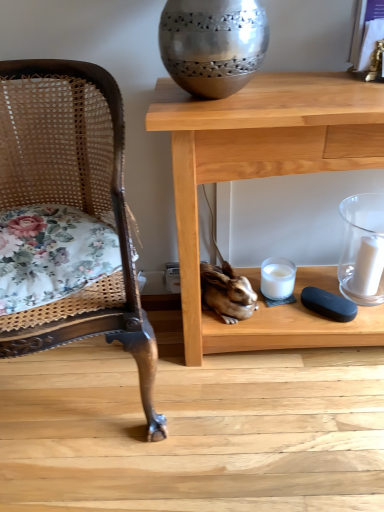
Question: From a real-world perspective, is white matte candle at right physically below woven cane chair at left?

Choices:
 (A) no
 (B) yes

Answer: (B)

Question: Is white matte candle at right thinner than woven cane chair at left?

Choices:
 (A) yes
 (B) no

Answer: (A)

Question: Does white matte candle at right have a greater height compared to woven cane chair at left?

Choices:
 (A) yes
 (B) no

Answer: (B)

Question: Is white matte candle at right smaller than woven cane chair at left?

Choices:
 (A) yes
 (B) no

Answer: (A)

Question: From a real-world perspective, is white matte candle at right located higher than woven cane chair at left?

Choices:
 (A) no
 (B) yes

Answer: (A)

Question: Considering the positions of woven cane chair at left and clear glass candle at right, marked as the 2th candle holder in a left-to-right arrangement, in the image, is woven cane chair at left taller or shorter than clear glass candle at right, marked as the 2th candle holder in a left-to-right arrangement,?

Choices:
 (A) short
 (B) tall

Answer: (B)

Question: Considering the positions of point (120, 141) and point (354, 252), is point (120, 141) closer or farther from the camera than point (354, 252)?

Choices:
 (A) farther
 (B) closer

Answer: (B)

Question: In terms of size, does woven cane chair at left appear bigger or smaller than clear glass candle at right, acting as the 1th candle holder starting from the right?

Choices:
 (A) small
 (B) big

Answer: (B)

Question: In terms of width, does woven cane chair at left look wider or thinner when compared to clear glass candle at right, acting as the 1th candle holder starting from the right?

Choices:
 (A) wide
 (B) thin

Answer: (A)

Question: From a real-world perspective, is white matte candle at right above or below wooden table at center?

Choices:
 (A) above
 (B) below

Answer: (B)

Question: Is white matte candle at right inside the boundaries of wooden table at center, or outside?

Choices:
 (A) outside
 (B) inside

Answer: (B)

Question: From the image's perspective, is white matte candle at right above or below wooden table at center?

Choices:
 (A) below
 (B) above

Answer: (A)

Question: Is white matte candle at right wider or thinner than wooden table at center?

Choices:
 (A) thin
 (B) wide

Answer: (A)

Question: Looking at the image, does white glass candle at lower center, marked as the first candle holder in a left-to-right arrangement, seem bigger or smaller compared to wooden table at center?

Choices:
 (A) small
 (B) big

Answer: (A)

Question: Choose the correct answer: Is white glass candle at lower center, which ranks as the 2th candle holder in right-to-left order, inside wooden table at center or outside it?

Choices:
 (A) outside
 (B) inside

Answer: (B)